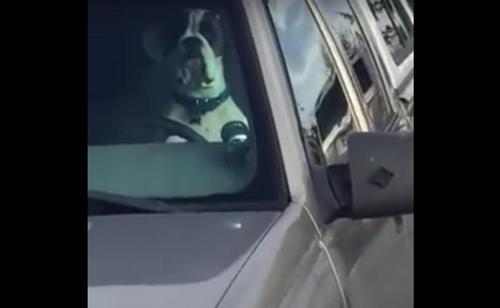
The width and height of the screenshot is (500, 308). I want to click on window, so click(x=317, y=84), click(x=343, y=41), click(x=388, y=29).